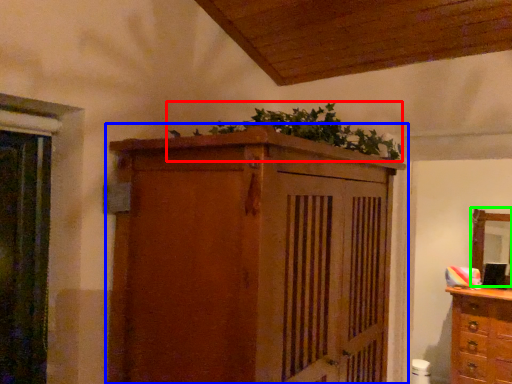
Question: Estimate the real-world distances between objects in this image. Which object is farther from plant (highlighted by a red box), cupboard (highlighted by a blue box) or mirror (highlighted by a green box)?

Choices:
 (A) cupboard
 (B) mirror

Answer: (B)